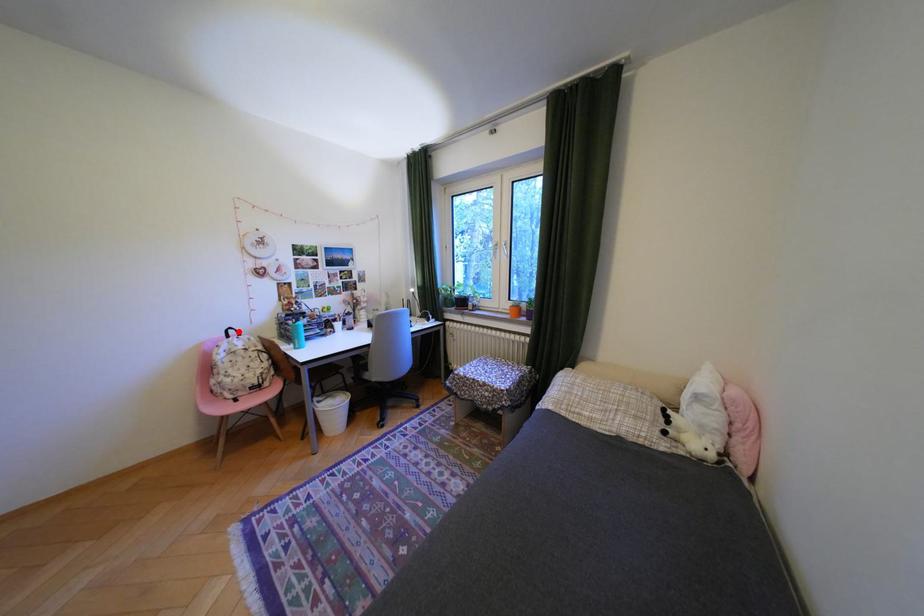
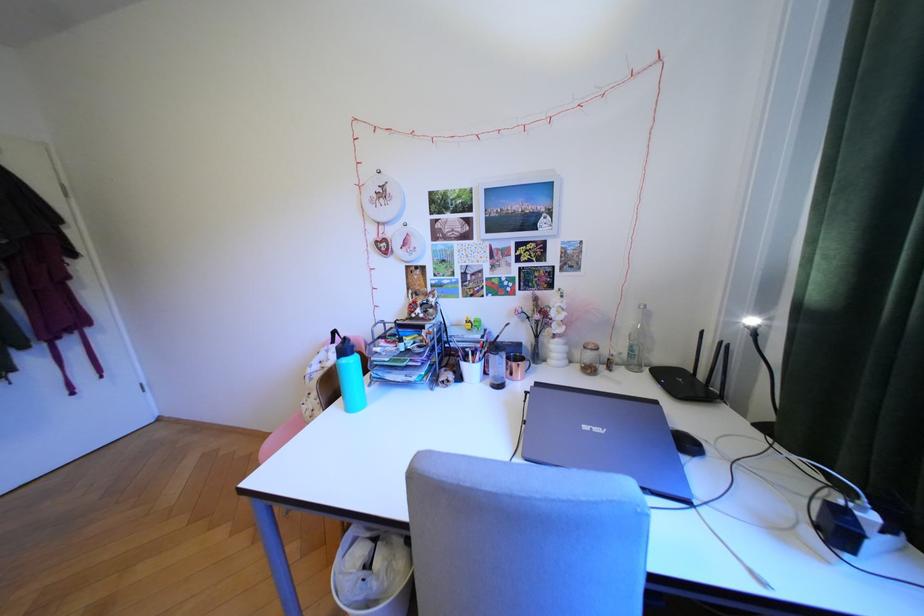
Question: I am providing you with two images of the same scene from different viewpoints. Given a red point in image1, look at the same physical point in image2. Is it:

Choices:
 (A) Closer to the viewpoint
 (B) Farther from the viewpoint

Answer: (B)